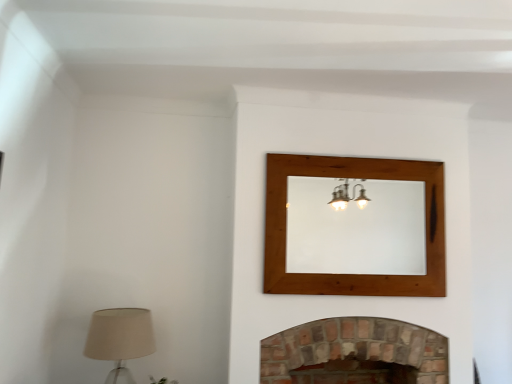
Describe the element at coordinates (356, 229) in the screenshot. I see `wooden mirror at upper center` at that location.

The image size is (512, 384). Identify the location of brick fireplace at lower center. (355, 347).

Which is in front, brick fireplace at lower center or wooden mirror at upper center?

Positioned in front is brick fireplace at lower center.

From a real-world perspective, relative to wooden mirror at upper center, is brick fireplace at lower center vertically above or below?

brick fireplace at lower center is below wooden mirror at upper center.

From the image's perspective, is brick fireplace at lower center on top of wooden mirror at upper center?

No, from the image's perspective, brick fireplace at lower center is not over wooden mirror at upper center.

From the picture: Considering the relative sizes of brick fireplace at lower center and wooden mirror at upper center in the image provided, is brick fireplace at lower center wider than wooden mirror at upper center?

Yes, brick fireplace at lower center is wider than wooden mirror at upper center.

Considering the sizes of objects wooden mirror at upper center and beige fabric lampshade at lower left in the image provided, who is bigger, wooden mirror at upper center or beige fabric lampshade at lower left?

With larger size is beige fabric lampshade at lower left.

Which of these two, wooden mirror at upper center or beige fabric lampshade at lower left, stands taller?

With more height is wooden mirror at upper center.

Based on the photo, from a real-world perspective, who is located lower, wooden mirror at upper center or beige fabric lampshade at lower left?

beige fabric lampshade at lower left is physically lower.

Based on their positions, is wooden mirror at upper center located to the left or right of beige fabric lampshade at lower left?

Based on their positions, wooden mirror at upper center is located to the right of beige fabric lampshade at lower left.

From the image's perspective, which is above, brick fireplace at lower center or beige fabric lampshade at lower left?

From the image's view, beige fabric lampshade at lower left is above.

From a real-world perspective, who is located lower, brick fireplace at lower center or beige fabric lampshade at lower left?

brick fireplace at lower center is physically lower.

Is beige fabric lampshade at lower left at the back of brick fireplace at lower center?

That's not correct — brick fireplace at lower center is not looking away from beige fabric lampshade at lower left.

Can you tell me how much brick fireplace at lower center and beige fabric lampshade at lower left differ in facing direction?

87.3 degrees.

Does wooden mirror at upper center have a greater height compared to brick fireplace at lower center?

Yes.

From the image's perspective, is wooden mirror at upper center positioned above or below brick fireplace at lower center?

wooden mirror at upper center is situated higher than brick fireplace at lower center in the image.

Considering the positions of points (379, 256) and (390, 336), is point (379, 256) closer to camera compared to point (390, 336)?

No, it is not.

Which object is closer to the camera, wooden mirror at upper center or brick fireplace at lower center?

Positioned in front is brick fireplace at lower center.

Considering the sizes of objects beige fabric lampshade at lower left and brick fireplace at lower center in the image provided, who is smaller, beige fabric lampshade at lower left or brick fireplace at lower center?

With smaller size is beige fabric lampshade at lower left.

How much distance is there between beige fabric lampshade at lower left and brick fireplace at lower center?

beige fabric lampshade at lower left is 1.02 meters away from brick fireplace at lower center.

Considering the relative positions of beige fabric lampshade at lower left and brick fireplace at lower center in the image provided, is beige fabric lampshade at lower left to the left or to the right of brick fireplace at lower center?

beige fabric lampshade at lower left is positioned on brick fireplace at lower center's left side.

From the image's perspective, is beige fabric lampshade at lower left below brick fireplace at lower center?

No, from the image's perspective, beige fabric lampshade at lower left is not beneath brick fireplace at lower center.

Is wooden mirror at upper center completely or partially inside beige fabric lampshade at lower left?

Actually, wooden mirror at upper center is outside beige fabric lampshade at lower left.

Consider the image. Who is bigger, beige fabric lampshade at lower left or wooden mirror at upper center?

With larger size is beige fabric lampshade at lower left.

From the image's perspective, is beige fabric lampshade at lower left above or below wooden mirror at upper center?

beige fabric lampshade at lower left is situated lower than wooden mirror at upper center in the image.

From a real-world perspective, who is located lower, beige fabric lampshade at lower left or wooden mirror at upper center?

beige fabric lampshade at lower left is physically lower.

The image size is (512, 384). I want to click on fireplace that appears below the wooden mirror at upper center (from the image's perspective), so click(355, 347).

Identify the location of table lamp that appears on the left of wooden mirror at upper center. This screenshot has height=384, width=512. (120, 339).

When comparing their distances from beige fabric lampshade at lower left, does brick fireplace at lower center or wooden mirror at upper center seem closer?

brick fireplace at lower center lies closer to beige fabric lampshade at lower left than the other object.

Looking at this image, which object lies nearer to the anchor point brick fireplace at lower center, beige fabric lampshade at lower left or wooden mirror at upper center?

wooden mirror at upper center is positioned closer to the anchor brick fireplace at lower center.

Looking at the image, which one is located further to wooden mirror at upper center, brick fireplace at lower center or beige fabric lampshade at lower left?

beige fabric lampshade at lower left.

Which object lies nearer to the anchor point brick fireplace at lower center, wooden mirror at upper center or beige fabric lampshade at lower left?

wooden mirror at upper center lies closer to brick fireplace at lower center than the other object.

Considering their positions, is wooden mirror at upper center positioned closer to beige fabric lampshade at lower left than brick fireplace at lower center?

The object closer to beige fabric lampshade at lower left is brick fireplace at lower center.

Looking at the image, which one is located further to wooden mirror at upper center, beige fabric lampshade at lower left or brick fireplace at lower center?

The object further to wooden mirror at upper center is beige fabric lampshade at lower left.

The height and width of the screenshot is (384, 512). What are the coordinates of `fireplace located between beige fabric lampshade at lower left and wooden mirror at upper center in the left-right direction` in the screenshot? It's located at (355, 347).